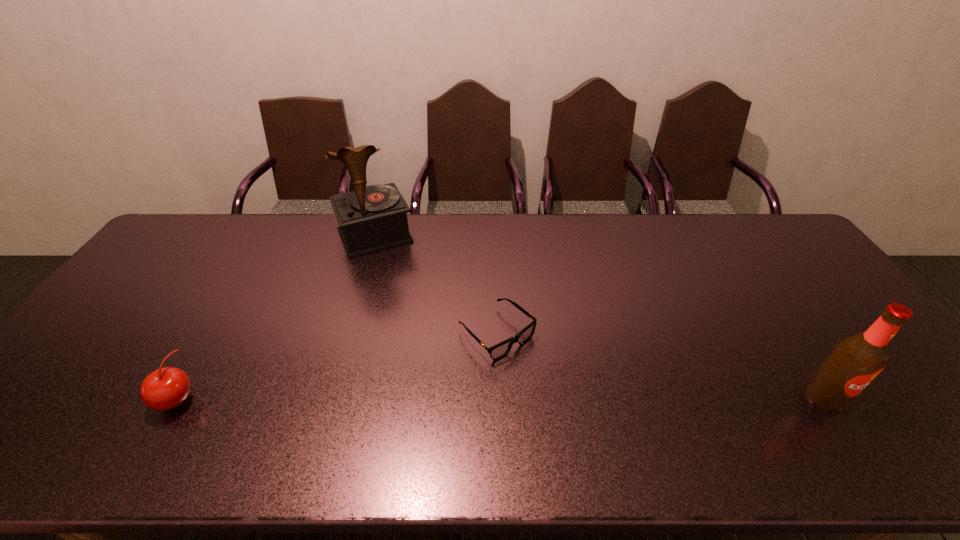
Image resolution: width=960 pixels, height=540 pixels. I want to click on the leftmost object, so click(166, 388).

Locate an element on the screen. cherry is located at coordinates (166, 388).

Where is `the second tallest object`? The height and width of the screenshot is (540, 960). the second tallest object is located at coordinates (855, 361).

At what (x,y) coordinates should I click in order to perform the action: click on the rightmost object. Please return your answer as a coordinate pair (x, y). Looking at the image, I should click on (855, 361).

The image size is (960, 540). Find the location of `the tallest object`. the tallest object is located at coordinates (373, 218).

I want to click on the farthest object, so click(373, 218).

The width and height of the screenshot is (960, 540). Identify the location of the third object from left to right. (500, 350).

Where is `sunglasses`? sunglasses is located at coordinates (500, 350).

Locate an element on the screen. The image size is (960, 540). vacant space situated on the back of the leftmost object is located at coordinates [227, 314].

The image size is (960, 540). Identify the location of vacant position located on the left of the second tallest object. (768, 397).